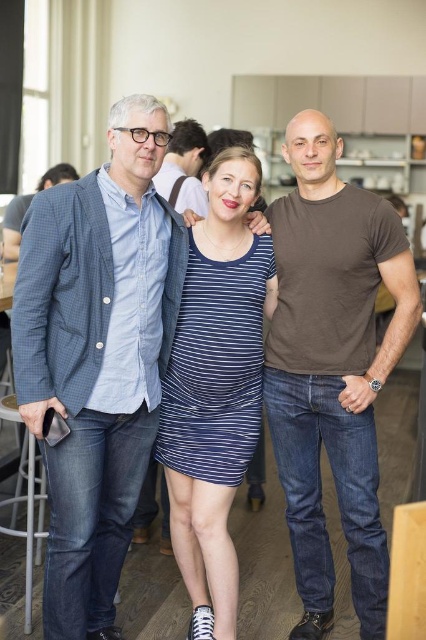
Based on the photo, based on the scene description, which clothing item is positioned lower on the central figure, the blue striped dress at center or the matte blue jeans at center?

The blue striped dress at center is positioned lower than the matte blue jeans at center.